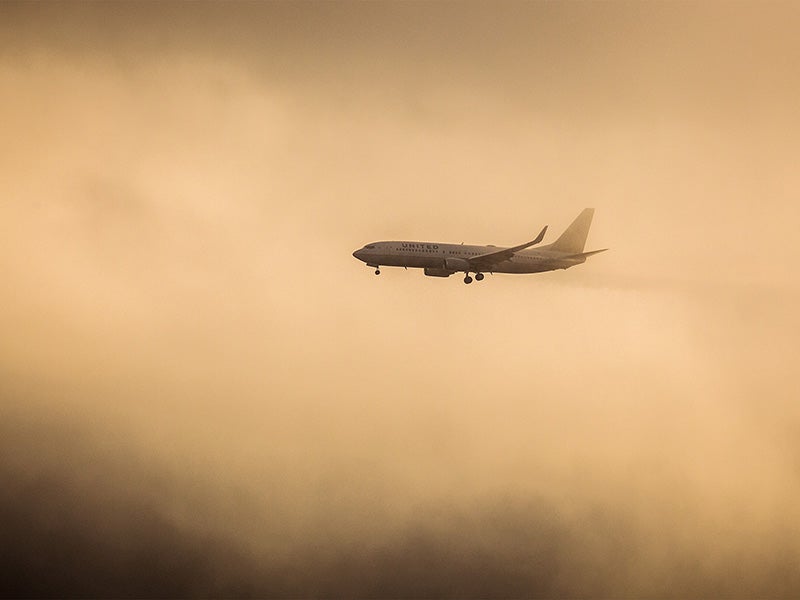
You are a GUI agent. You are given a task and a screenshot of the screen. Output one action in this format:
    pyautogui.click(x=<x>, y=<y>)
    Task: Click on the windows
    The width and height of the screenshot is (800, 600).
    Given the screenshot: What is the action you would take?
    pyautogui.click(x=418, y=248), pyautogui.click(x=449, y=250), pyautogui.click(x=472, y=252)